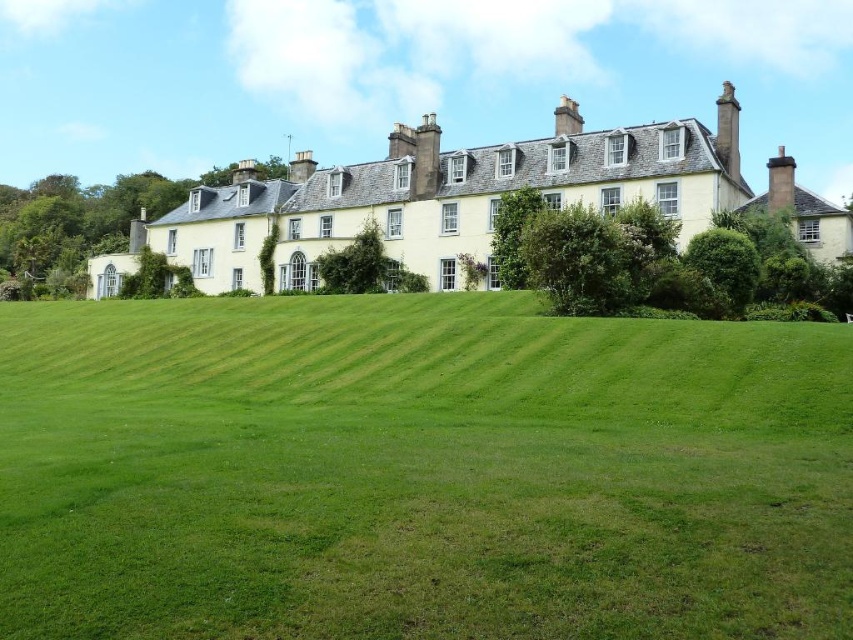
Is green grass at center to the left of yellow stone building at center from the viewer's perspective?

Indeed, green grass at center is positioned on the left side of yellow stone building at center.

Consider the image. Who is more distant from viewer, [323,444] or [474,257]?

Point [474,257]

The image size is (853, 640). I want to click on green grass at center, so click(x=419, y=472).